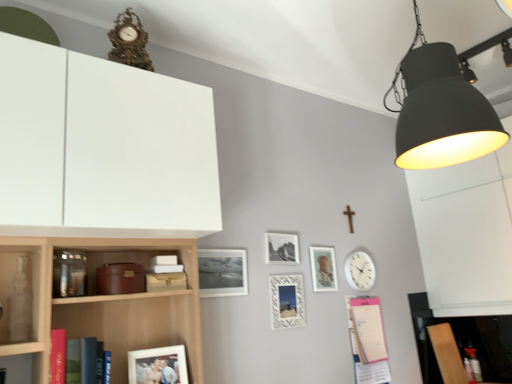
Question: Is hardcover book at left, which is counted as the 1th book, starting from the left, taller or shorter than gold ornate clock at upper center, which is the first clock from left to right?

Choices:
 (A) short
 (B) tall

Answer: (A)

Question: Is hardcover book at left, the second book from the back, bigger or smaller than gold ornate clock at upper center, which is the first clock from top to bottom?

Choices:
 (A) big
 (B) small

Answer: (B)

Question: Which of these objects is positioned farthest from the white plastic clock at upper right, the first clock viewed from the back?

Choices:
 (A) hardcover book at left, which is the first book in front-to-back order
 (B) white matte cabinet at upper left
 (C) metallic silver frame at center, placed as the second picture frame when sorted from back to front
 (D) gold ornate clock at upper center, the 2th clock from the right
 (E) matte silver picture frame at center-right, placed as the fifth picture frame when sorted from front to back

Answer: (D)

Question: Which object is the closest to the pink paper notepad at lower right, marked as the second book in a left-to-right arrangement?

Choices:
 (A) hardcover book at left, which is counted as the first book, starting from the top
 (B) metallic silver frame at center, positioned as the fourth picture frame in front-to-back order
 (C) white textured picture frame at center, placed as the second picture frame when sorted from right to left
 (D) gold ornate clock at upper center, acting as the 1th clock starting from the front
 (E) matte black lampshade at upper right

Answer: (C)